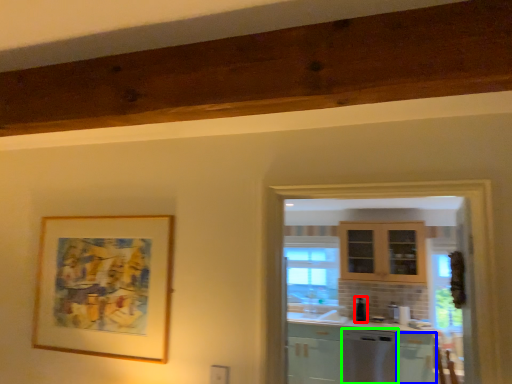
Question: Based on their relative distances, which object is nearer to appliance (highlighted by a red box)? Choose from cabinetry (highlighted by a blue box) and dish washer (highlighted by a green box).

Choices:
 (A) cabinetry
 (B) dish washer

Answer: (B)